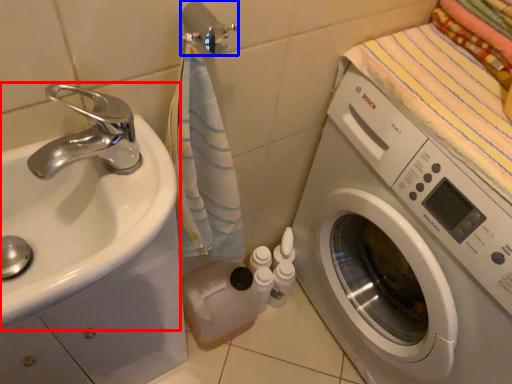
Question: Among these objects, which one is nearest to the camera, sink (highlighted by a red box) or towel bar (highlighted by a blue box)?

Choices:
 (A) sink
 (B) towel bar

Answer: (A)